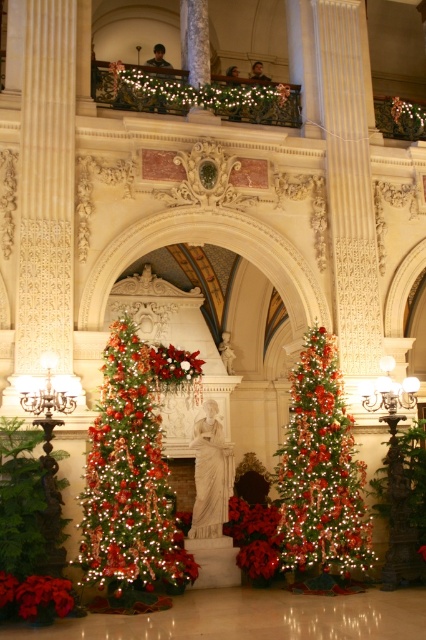
You are a decorator planning to place a new holiday decoration between the shiny green christmas tree at left and the green shiny christmas tree at center. Given their sizes, which tree should you place the decoration closer to?

The shiny green christmas tree at left is larger in size than the green shiny christmas tree at center, so you should place the decoration closer to the shiny green christmas tree at left to maintain visual balance.

You are standing in the lobby and want to take a photo of the shiny green christmas tree at left and the green shiny christmas tree at center. Which one will appear larger in your photo?

The shiny green christmas tree at left will appear larger in the photo because it is closer to you than the green shiny christmas tree at center.

You are standing in the grand lobby and want to place a new decoration. You have two points marked on the wall where you can hang it. The points are labeled as point 1 at coordinates point (158, 458) and point 2 at coordinates point (308, 444). Which point is closer to you where you can hang the decoration?

Point (158, 458) is closer to the viewer than point (308, 444), so you should hang the decoration there.